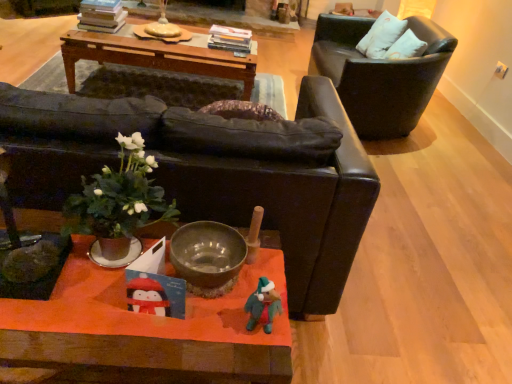
Locate an element on the screen. free spot in front of black leather chair at upper right, placed as the 2th chair when sorted from left to right is located at coordinates (435, 191).